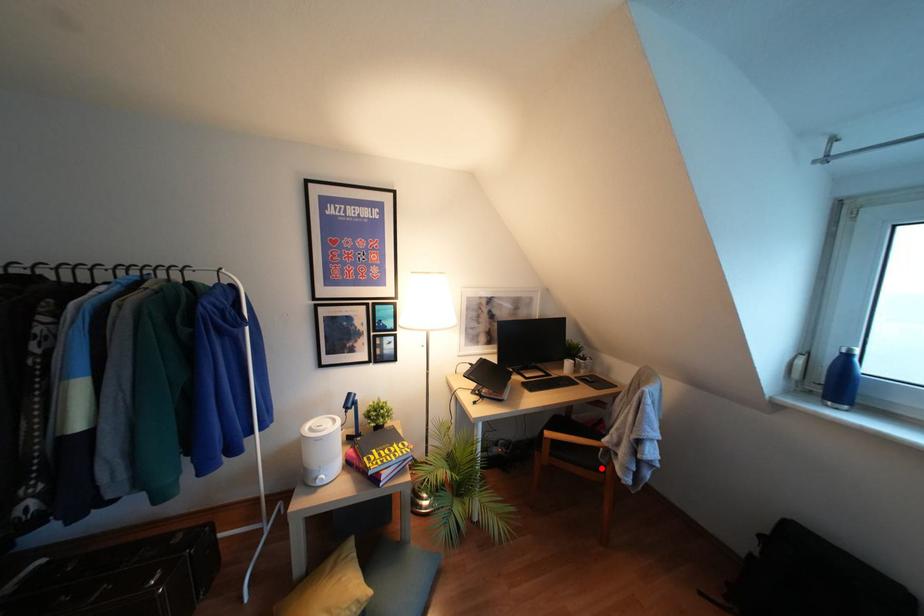
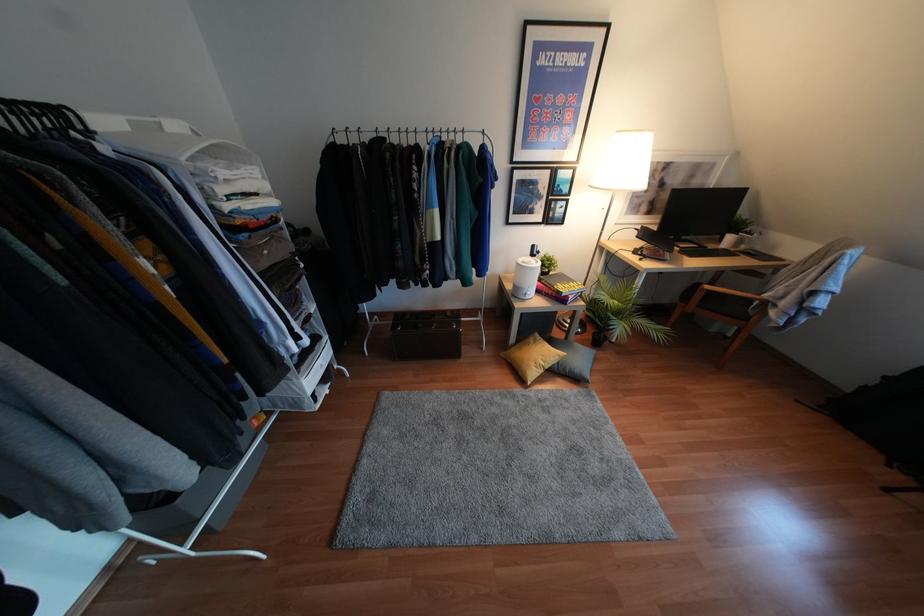
Find the pixel in the second image that matches the highlighted location in the first image.

(745, 318)